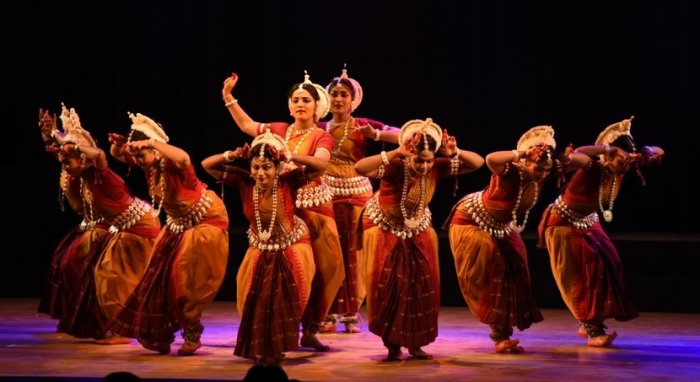
This screenshot has width=700, height=382. Identify the location of bench. (637, 254).